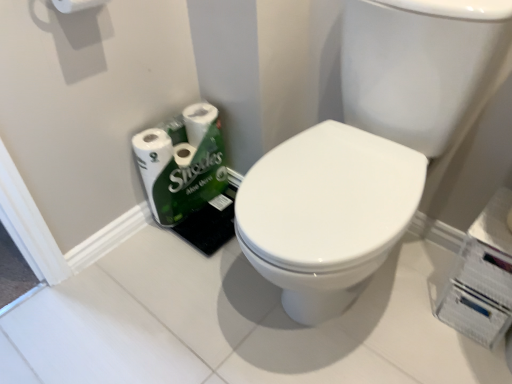
Locate an element on the screen. free space underneath white glossy toilet paper at lower left, which is counted as the second toilet paper, starting from the top (from a real-world perspective) is located at coordinates (203, 211).